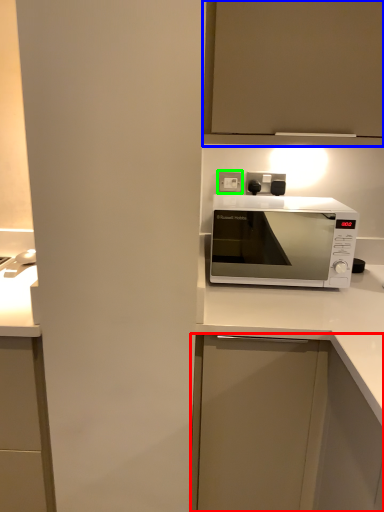
Question: Considering the real-world distances, which object is farthest from cabinetry (highlighted by a red box)? cabinetry (highlighted by a blue box) or electric outlet (highlighted by a green box)?

Choices:
 (A) cabinetry
 (B) electric outlet

Answer: (A)